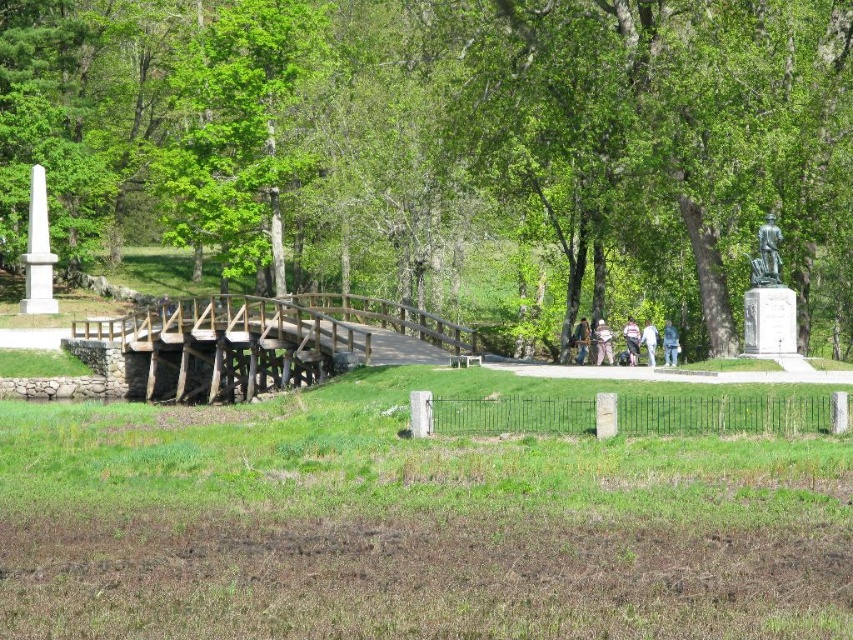
Who is positioned more to the left, bronze statue at right or brown leather jacket at center?

brown leather jacket at center is more to the left.

Does bronze statue at right appear on the left side of brown leather jacket at center?

In fact, bronze statue at right is to the right of brown leather jacket at center.

I want to click on bronze statue at right, so click(769, 298).

Can you confirm if light brown fabric jacket at center is smaller than light blue jeans at center?

No.

Who is more forward, [599,356] or [641,337]?

Point [599,356]

Locate an element on the screen. light brown fabric jacket at center is located at coordinates (602, 342).

Is point (762, 291) positioned in front of point (32, 260)?

Yes, point (762, 291) is closer to viewer.

Which is behind, point (759, 246) or point (45, 276)?

Point (45, 276)

The height and width of the screenshot is (640, 853). In order to click on bronze statue at right in this screenshot , I will do `click(769, 298)`.